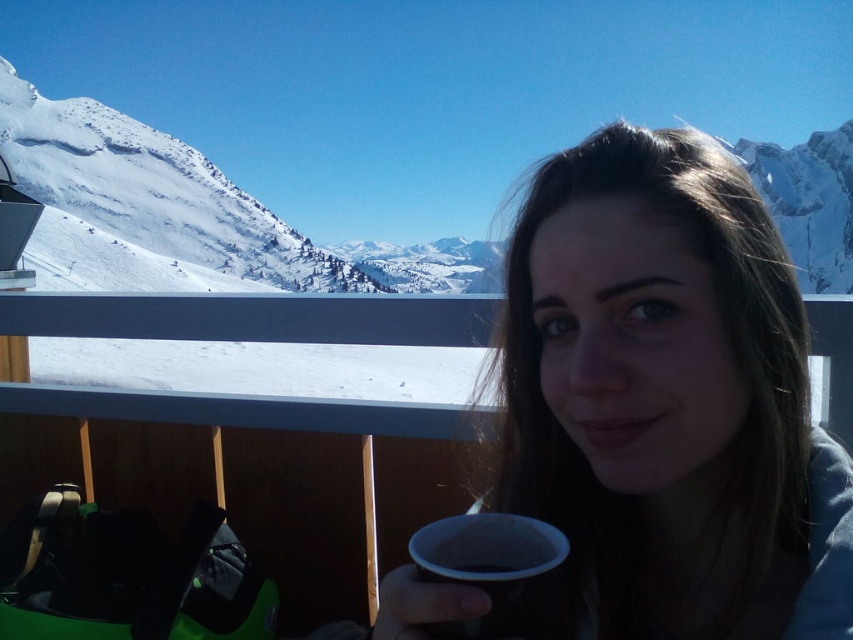
Question: Considering the real-world distances, which object is closest to the matte black cup at center?

Choices:
 (A) white matte cup at lower center
 (B) black matte cup at lower center

Answer: (B)

Question: Is black ceramic cup at lower center positioned at the back of white matte cup at lower center?

Choices:
 (A) yes
 (B) no

Answer: (A)

Question: Estimate the real-world distances between objects in this image. Which object is farther from the snowy white mountain at upper left?

Choices:
 (A) matte black cup at center
 (B) black ceramic cup at lower center
 (C) white matte cup at lower center

Answer: (C)

Question: Which point is closer to the camera?

Choices:
 (A) black matte cup at lower center
 (B) white matte cup at lower center
 (C) snowy white mountain at upper left

Answer: (B)

Question: Does snowy white mountain at upper left appear on the left side of black ceramic cup at lower center?

Choices:
 (A) yes
 (B) no

Answer: (B)

Question: In this image, where is matte black cup at center located relative to black matte cup at lower center?

Choices:
 (A) right
 (B) left

Answer: (A)